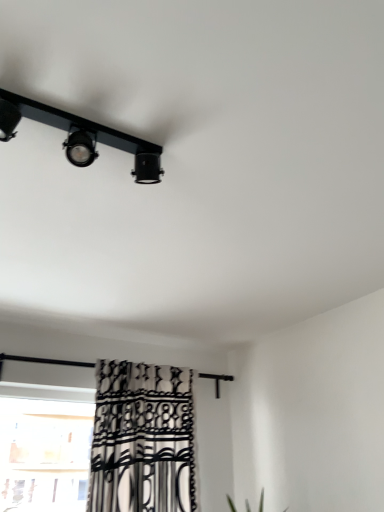
Question: From the image's perspective, is black matte track light at upper left located above or below black and white patterned curtain at lower left?

Choices:
 (A) below
 (B) above

Answer: (B)

Question: Is point (94, 136) closer or farther from the camera than point (135, 477)?

Choices:
 (A) farther
 (B) closer

Answer: (B)

Question: Considering the relative positions of black matte track light at upper left and black and white patterned curtain at lower left in the image provided, is black matte track light at upper left to the left or to the right of black and white patterned curtain at lower left?

Choices:
 (A) right
 (B) left

Answer: (B)

Question: Is black and white patterned curtain at lower left spatially inside black matte track light at upper left, or outside of it?

Choices:
 (A) outside
 (B) inside

Answer: (A)

Question: From their relative heights in the image, would you say black and white patterned curtain at lower left is taller or shorter than black matte track light at upper left?

Choices:
 (A) tall
 (B) short

Answer: (A)

Question: Is black and white patterned curtain at lower left bigger or smaller than black matte track light at upper left?

Choices:
 (A) big
 (B) small

Answer: (A)

Question: Is black and white patterned curtain at lower left in front of or behind black matte track light at upper left in the image?

Choices:
 (A) front
 (B) behind

Answer: (B)